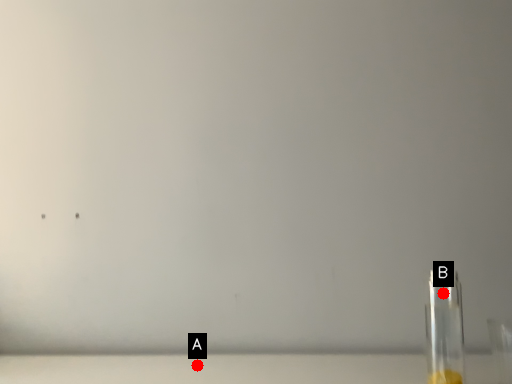
Question: Two points are circled on the image, labeled by A and B beside each circle. Among these points, which one is farthest from the camera?

Choices:
 (A) A is further
 (B) B is further

Answer: (B)